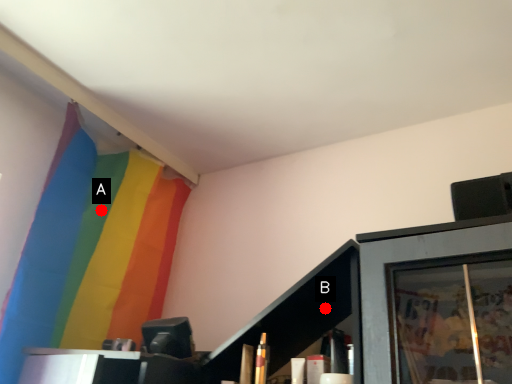
Question: Two points are circled on the image, labeled by A and B beside each circle. Which point is closer to the camera?

Choices:
 (A) A is closer
 (B) B is closer

Answer: (B)